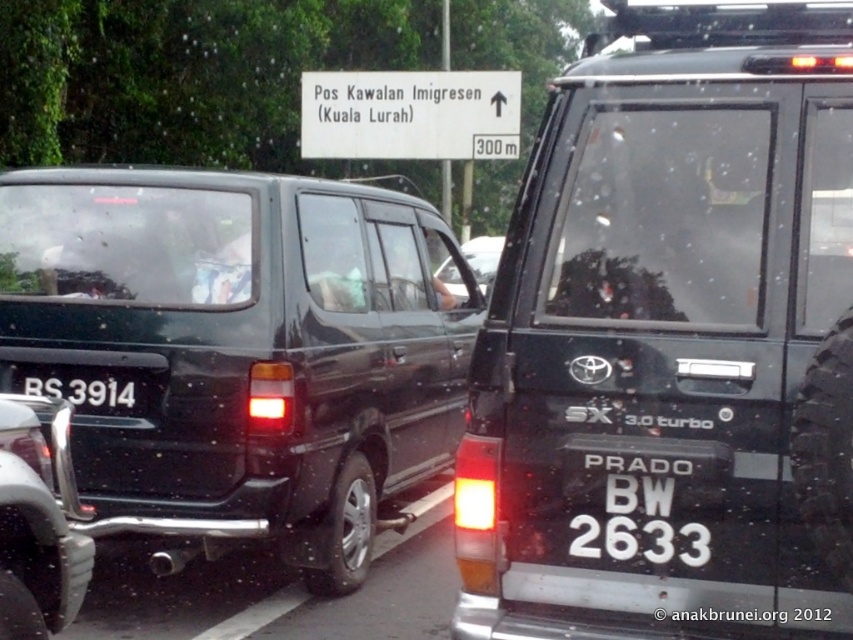
Question: Does black matte van at right appear over brushed metal bumper at rear?

Choices:
 (A) no
 (B) yes

Answer: (B)

Question: Considering the relative positions of white plastic license plate at center and brushed metal bumper at rear in the image provided, where is white plastic license plate at center located with respect to brushed metal bumper at rear?

Choices:
 (A) left
 (B) right

Answer: (B)

Question: Which point is closer to the camera?

Choices:
 (A) brushed metal bumper at rear
 (B) black matte van at center
 (C) white plastic license plate at center

Answer: (C)

Question: Which object appears closest to the camera in this image?

Choices:
 (A) black matte van at center
 (B) white plastic license plate at center

Answer: (B)

Question: Considering the relative positions of brushed metal bumper at rear and black plastic license plate at rear in the image provided, where is brushed metal bumper at rear located with respect to black plastic license plate at rear?

Choices:
 (A) right
 (B) left

Answer: (A)

Question: Which of the following is the farthest from the observer?

Choices:
 (A) black plastic license plate at rear
 (B) black matte van at right
 (C) black matte van at center
 (D) white plastic license plate at center

Answer: (A)